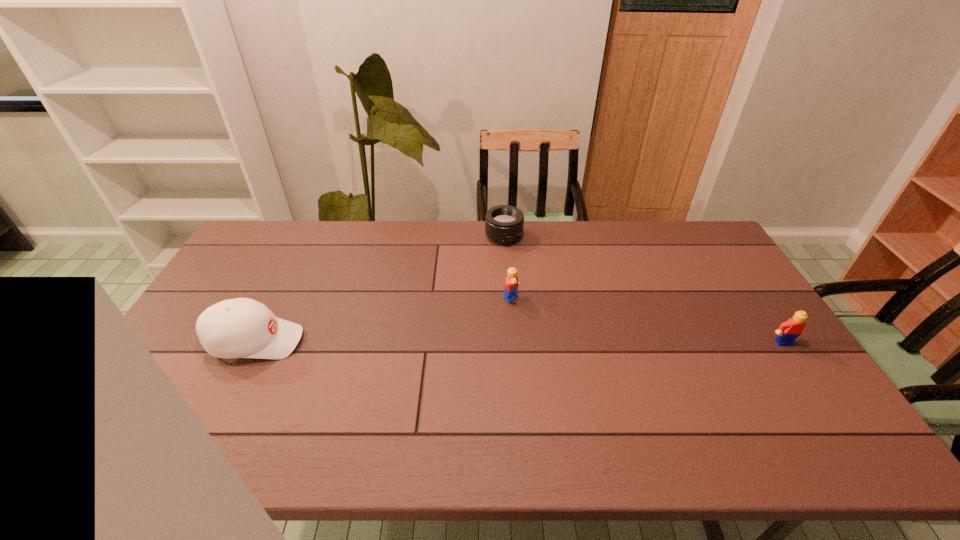
Locate an element on the screen. This screenshot has height=540, width=960. free space that is in between the left Lego and the leftmost object is located at coordinates (384, 320).

This screenshot has height=540, width=960. Find the location of `the closest object to the telephoto lens`. the closest object to the telephoto lens is located at coordinates (511, 283).

In order to click on object that is the closest to the telephoto lens in this screenshot , I will do `click(511, 283)`.